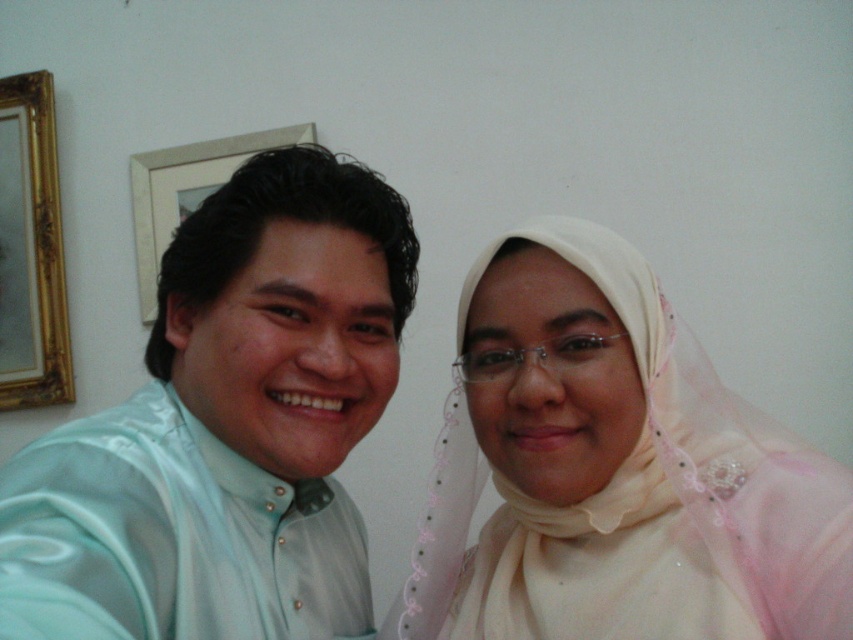
Question: Which point is closer to the camera?

Choices:
 (A) light blue satin shirt at left
 (B) white matte picture frame at upper left
 (C) gold ornate mirror at upper left

Answer: (A)

Question: From the image, what is the correct spatial relationship of light blue satin shirt at left in relation to gold ornate mirror at upper left?

Choices:
 (A) left
 (B) right

Answer: (B)

Question: Is gold ornate mirror at upper left above white matte picture frame at upper left?

Choices:
 (A) yes
 (B) no

Answer: (B)

Question: Which point appears closest to the camera in this image?

Choices:
 (A) (772, 596)
 (B) (302, 470)

Answer: (A)

Question: Which is farther from the gold ornate mirror at upper left?

Choices:
 (A) white matte picture frame at upper left
 (B) light blue satin shirt at left

Answer: (B)

Question: Can you confirm if gold ornate mirror at upper left is positioned above white matte picture frame at upper left?

Choices:
 (A) no
 (B) yes

Answer: (A)